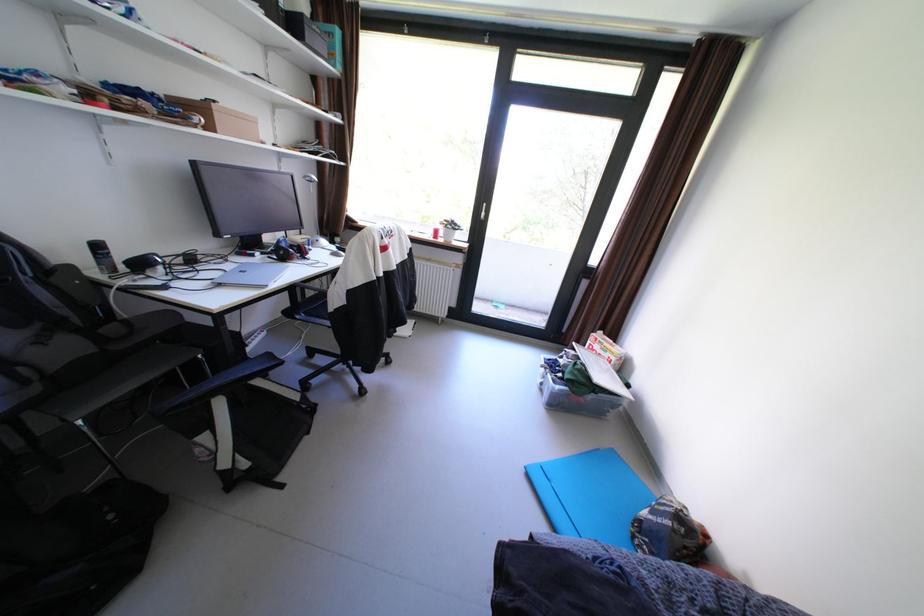
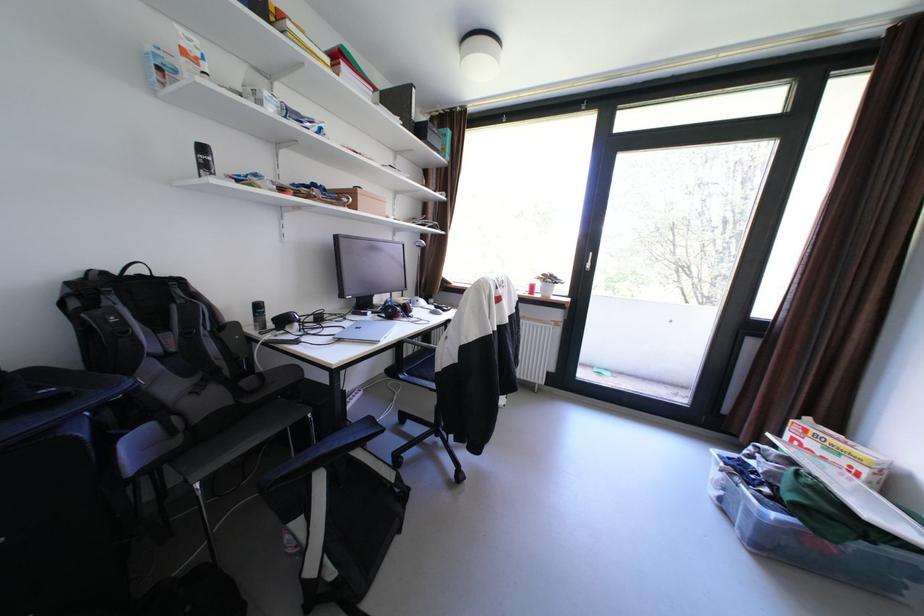
Question: The images are taken continuously from a first-person perspective. In which direction is your viewpoint rotating?

Choices:
 (A) Left
 (B) Right
 (C) Up
 (D) Down

Answer: (A)